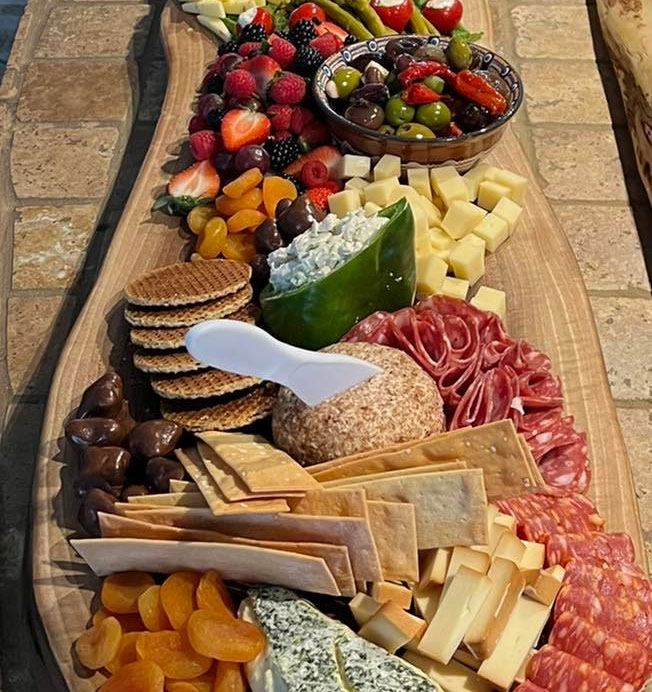
Locate an element on the screen. charcuterie board is located at coordinates (520, 298).